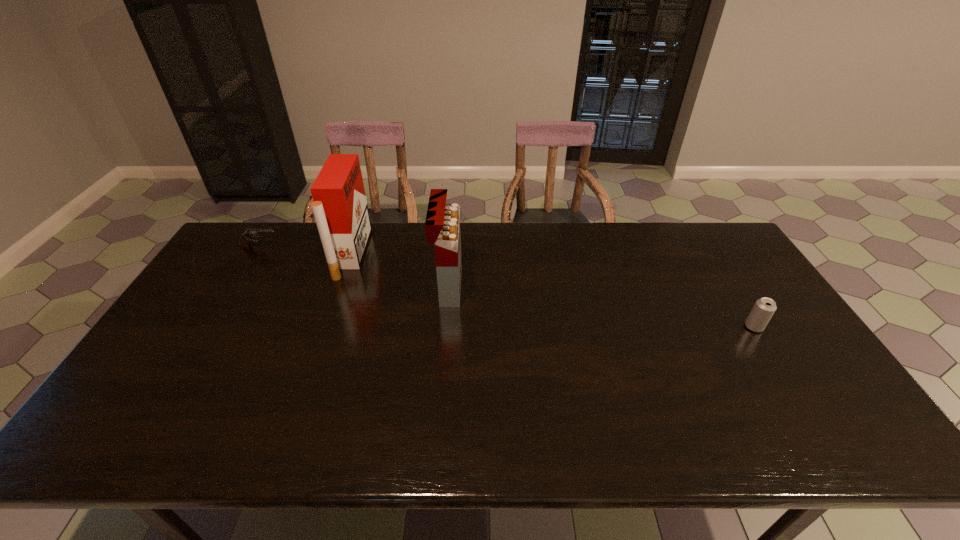
Choose which object is the second nearest neighbor to the shortest object. Please provide its 2D coordinates. Your answer should be formatted as a tuple, i.e. [(x, y)], where the tuple contains the x and y coordinates of a point satisfying the conditions above.

[(442, 226)]

Locate which object ranks second in proximity to the shortest object. Please provide its 2D coordinates. Your answer should be formatted as a tuple, i.e. [(x, y)], where the tuple contains the x and y coordinates of a point satisfying the conditions above.

[(442, 226)]

Find the location of a particular element. The image size is (960, 540). free space that satisfies the following two spatial constraints: 1. at the barrel of the rightmost object; 2. on the left side of the pistol is located at coordinates (211, 327).

You are a GUI agent. You are given a task and a screenshot of the screen. Output one action in this format:
    pyautogui.click(x=<x>, y=<y>)
    Task: Click on the free location that satisfies the following two spatial constraints: 1. on the front-facing side of the third object from right to left; 2. on the back side of the beer can
    
    Given the screenshot: What is the action you would take?
    325,327

Identify the location of vacant area in the image that satisfies the following two spatial constraints: 1. on the back side of the rightmost object; 2. with the lid open on the second object from right to left. tap(729, 286).

Find the location of a particular element. free space in the image that satisfies the following two spatial constraints: 1. at the barrel of the shortest object; 2. on the right side of the beer can is located at coordinates (211, 327).

This screenshot has width=960, height=540. I want to click on blank space that satisfies the following two spatial constraints: 1. with the lid open on the right cigarette case; 2. on the right side of the second shortest object, so click(x=444, y=327).

Locate an element on the screen. The height and width of the screenshot is (540, 960). vacant space that satisfies the following two spatial constraints: 1. with the lid open on the right cigarette case; 2. on the back side of the nearest object is located at coordinates (444, 327).

You are a GUI agent. You are given a task and a screenshot of the screen. Output one action in this format:
    pyautogui.click(x=<x>, y=<y>)
    Task: Click on the free space that satisfies the following two spatial constraints: 1. with the lid open on the right cigarette case; 2. on the back side of the nearest object
    The height and width of the screenshot is (540, 960).
    Given the screenshot: What is the action you would take?
    pyautogui.click(x=444, y=327)

The image size is (960, 540). What are the coordinates of `blank space that satisfies the following two spatial constraints: 1. on the front-facing side of the left cigarette case; 2. on the left side of the second shortest object` in the screenshot? It's located at (325, 327).